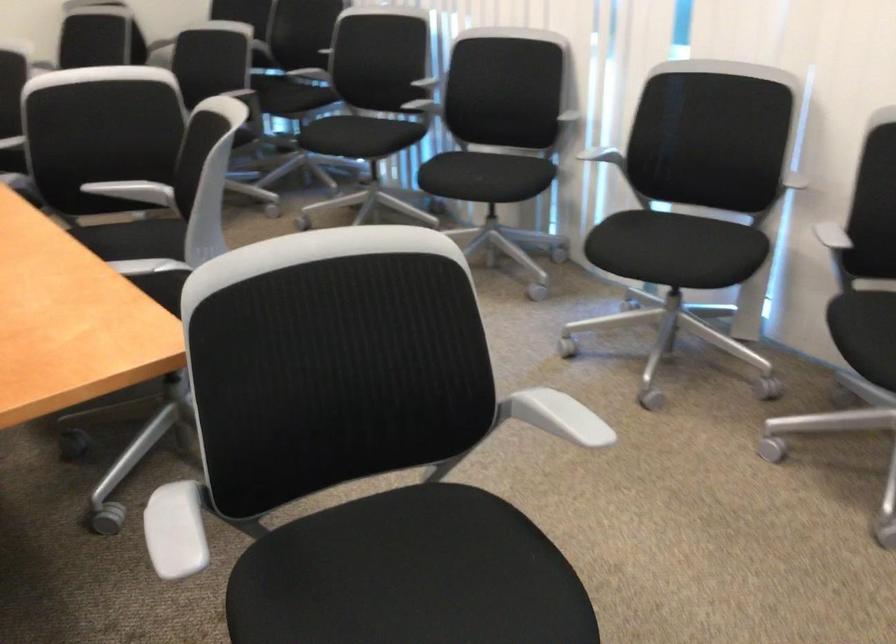
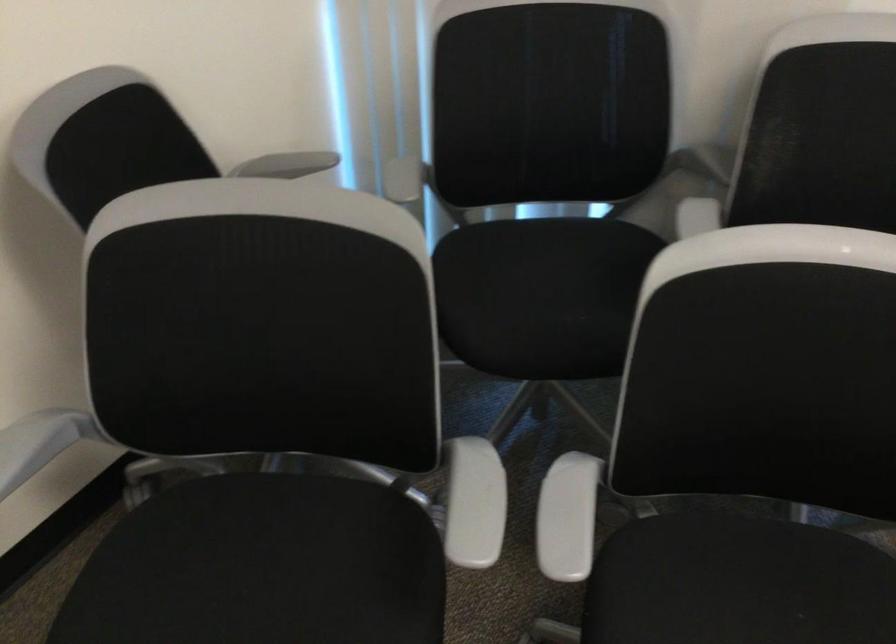
In a continuous first-person perspective shot, in which direction is the camera moving?

The movement direction of the cameraman is left, forward.